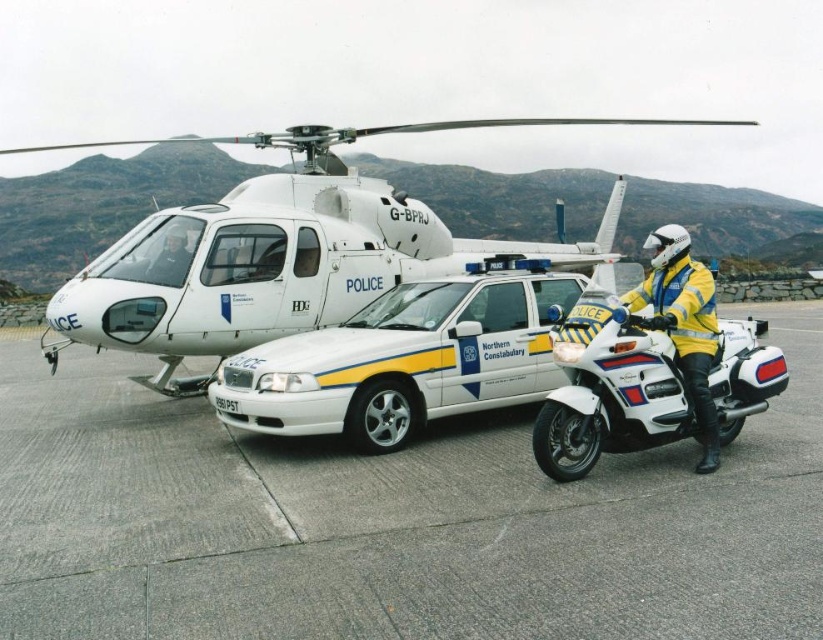
Question: Does gray asphalt at center appear on the left side of white glossy motorcycle at center?

Choices:
 (A) no
 (B) yes

Answer: (B)

Question: Does white glossy police car at center come behind white glossy motorcycle at center?

Choices:
 (A) no
 (B) yes

Answer: (B)

Question: Does gray asphalt at center appear over yellow matte jacket at center?

Choices:
 (A) yes
 (B) no

Answer: (B)

Question: Among these objects, which one is nearest to the camera?

Choices:
 (A) yellow matte jacket at center
 (B) white glossy police car at center

Answer: (A)

Question: Which point appears closest to the camera in this image?

Choices:
 (A) (173, 484)
 (B) (667, 241)
 (C) (66, 316)

Answer: (B)

Question: Which object is the closest to the white matte helicopter at upper center?

Choices:
 (A) gray asphalt at center
 (B) white glossy police car at center
 (C) black plastic license plate at center

Answer: (B)